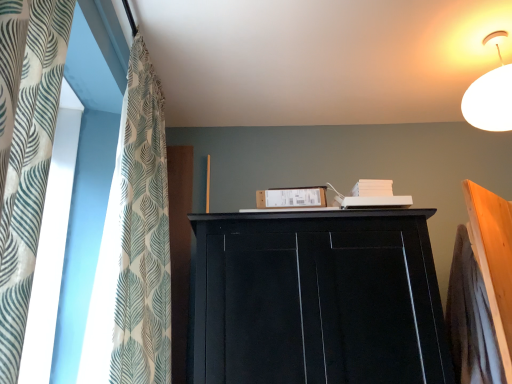
What are the coordinates of `free spot above white textured fabric at left (from a real-world perspective)` in the screenshot? It's located at (170, 64).